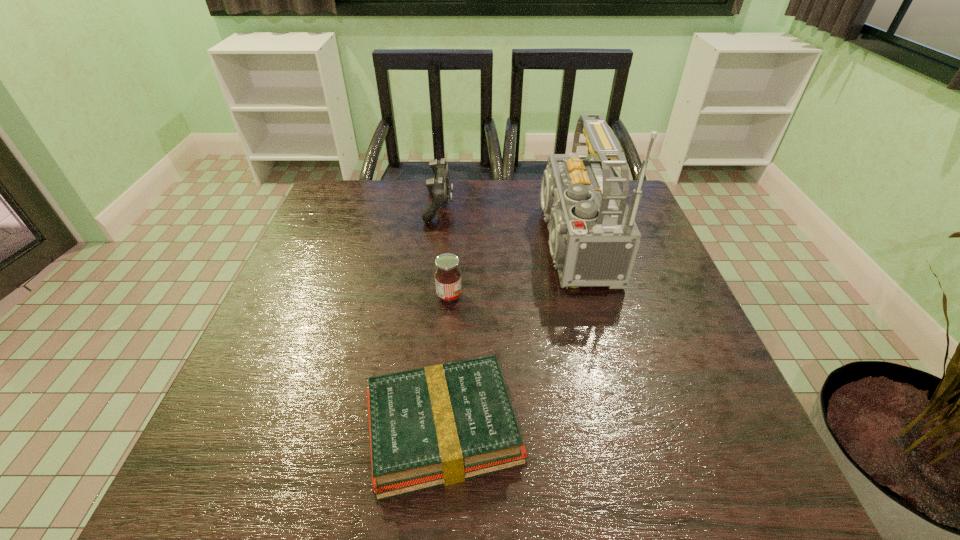
Find the location of `vacant region located on the label side of the jam`. vacant region located on the label side of the jam is located at coordinates (636, 296).

Locate an element on the screen. This screenshot has height=540, width=960. blank area located on the left of the nearest object is located at coordinates (304, 429).

The image size is (960, 540). I want to click on radio receiver that is at the far edge, so click(593, 237).

Identify the location of control present at the far edge. (438, 185).

This screenshot has width=960, height=540. I want to click on object situated at the near edge, so click(440, 425).

At what (x,y) coordinates should I click in order to perform the action: click on object that is at the right edge. Please return your answer as a coordinate pair (x, y). Image resolution: width=960 pixels, height=540 pixels. Looking at the image, I should click on (593, 237).

Locate an element on the screen. This screenshot has width=960, height=540. object present at the far right corner is located at coordinates (593, 237).

Image resolution: width=960 pixels, height=540 pixels. In the image, there is a desktop. In order to click on vacant space at the far edge in this screenshot , I will do `click(524, 223)`.

I want to click on vacant space at the near edge of the desktop, so click(x=319, y=450).

In the image, there is a desktop. Where is `free region at the left edge`? free region at the left edge is located at coordinates (269, 422).